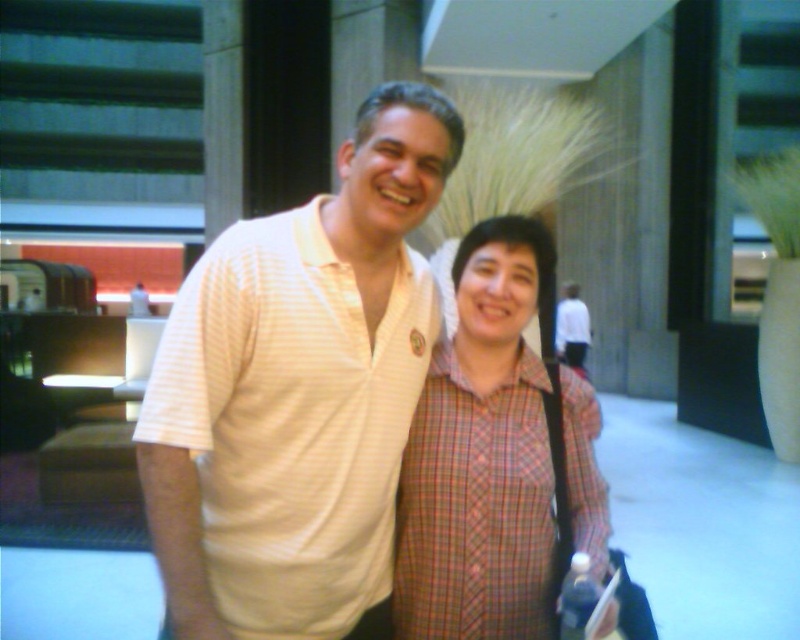
Does white striped polo shirt at center have a greater width compared to plaid fabric shirt at center?

Yes.

Image resolution: width=800 pixels, height=640 pixels. In order to click on white striped polo shirt at center in this screenshot , I will do `click(297, 392)`.

Find the location of `white striped polo shirt at center`. white striped polo shirt at center is located at coordinates (297, 392).